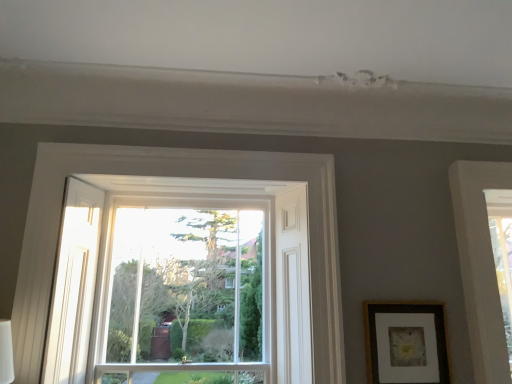
Question: Looking at the image, does clear glass window at center seem bigger or smaller compared to matte brown picture frame at right?

Choices:
 (A) small
 (B) big

Answer: (B)

Question: Is clear glass window at center spatially inside matte brown picture frame at right, or outside of it?

Choices:
 (A) inside
 (B) outside

Answer: (B)

Question: In terms of width, does clear glass window at center look wider or thinner when compared to matte brown picture frame at right?

Choices:
 (A) thin
 (B) wide

Answer: (B)

Question: From a real-world perspective, is matte brown picture frame at right above or below clear glass window at center?

Choices:
 (A) below
 (B) above

Answer: (A)

Question: Looking at their shapes, would you say matte brown picture frame at right is wider or thinner than clear glass window at center?

Choices:
 (A) thin
 (B) wide

Answer: (A)

Question: Considering the positions of matte brown picture frame at right and clear glass window at center in the image, is matte brown picture frame at right taller or shorter than clear glass window at center?

Choices:
 (A) tall
 (B) short

Answer: (B)

Question: Based on their positions, is matte brown picture frame at right located to the left or right of clear glass window at center?

Choices:
 (A) left
 (B) right

Answer: (B)